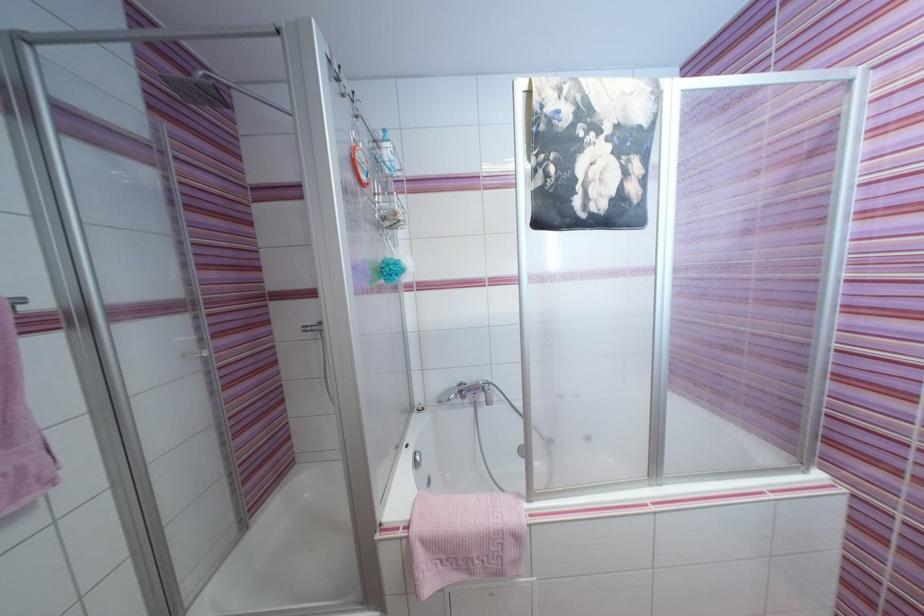
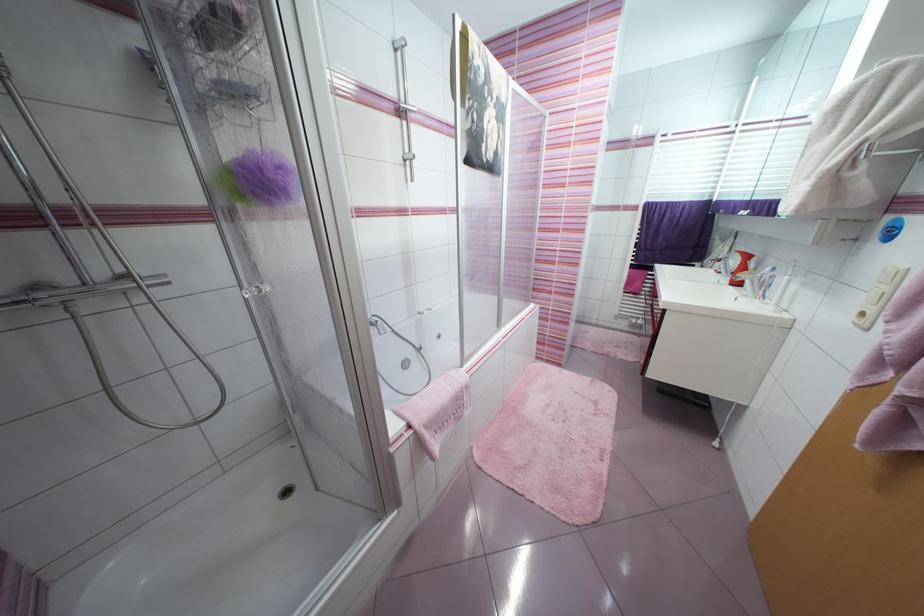
Question: The camera is either moving clockwise (left) or counter-clockwise (right) around the object. The first image is from the beginning of the video and the second image is from the end. Is the camera moving left or right when shooting the video?

Choices:
 (A) Left
 (B) Right

Answer: (A)